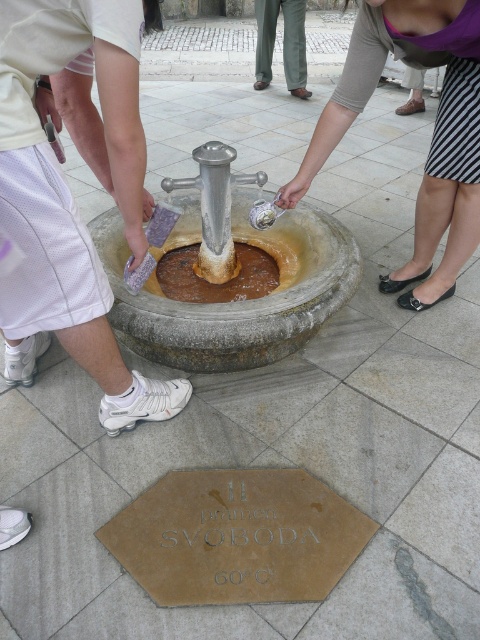
You are standing at the public fountain labeled Pramen Svoboda. You see a striped skirt at lower right and a brown stone fountain at center. Which object is closer to your feet?

The striped skirt at lower right is located above the brown stone fountain at center, so the striped skirt at lower right is closer to your feet.

You are standing at the public fountain called Pramen Svoboda, which has a striped skirt at lower right and a brown stone fountain at center. From your perspective, which object is wider?

The striped skirt at lower right is wider than the brown stone fountain at center.

You are a tourist visiting the Pramen Svoboda fountain. You notice a striped skirt at lower right and a green fabric pants at center. Which of these items is closer to you?

The striped skirt at lower right is closer to you because it is in front of the green fabric pants at center.